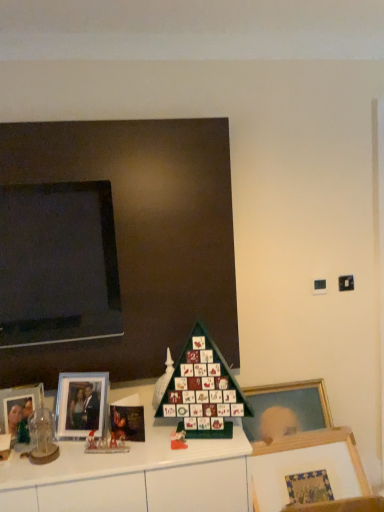
This screenshot has height=512, width=384. What are the coordinates of `free space between clear glass dome at left, the first toy from the left, and matte plastic advent calendar at center, which ranks as the 1th toy in right-to-left order` in the screenshot? It's located at (112, 450).